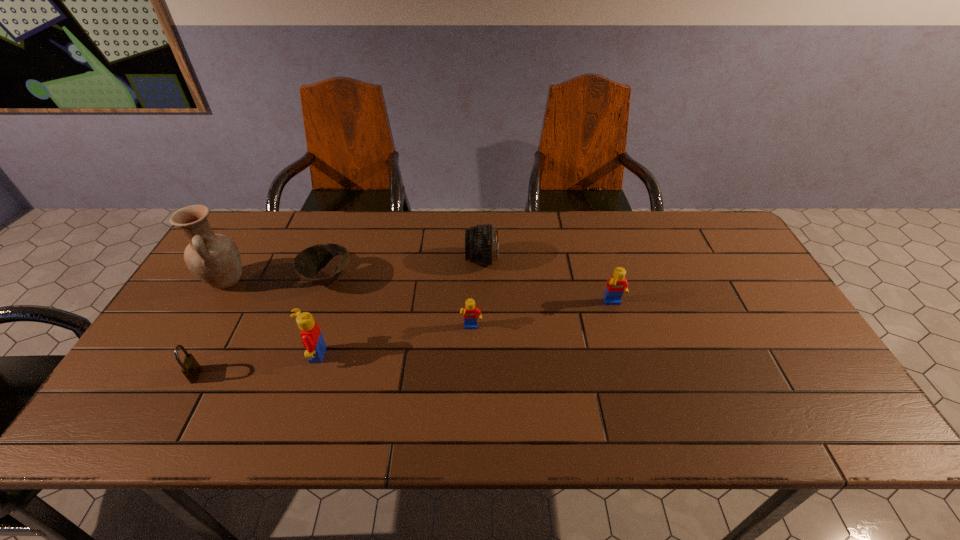
Where is `the leftmost Lego`? The height and width of the screenshot is (540, 960). the leftmost Lego is located at coordinates (311, 335).

Where is `the second tallest object`? The width and height of the screenshot is (960, 540). the second tallest object is located at coordinates [x=311, y=335].

The image size is (960, 540). Find the location of `the second Lego from left to right`. the second Lego from left to right is located at coordinates (470, 312).

I want to click on the shortest Lego, so click(470, 312).

At what (x,y) coordinates should I click in order to perform the action: click on the second tallest Lego. Please return your answer as a coordinate pair (x, y). This screenshot has width=960, height=540. Looking at the image, I should click on (617, 284).

Locate an element on the screen. The height and width of the screenshot is (540, 960). the farthest Lego is located at coordinates (617, 284).

The height and width of the screenshot is (540, 960). I want to click on the tallest object, so click(215, 259).

Locate an element on the screen. bowl is located at coordinates (309, 261).

Locate an element on the screen. This screenshot has width=960, height=540. telephoto lens is located at coordinates (481, 242).

I want to click on padlock, so click(x=190, y=367).